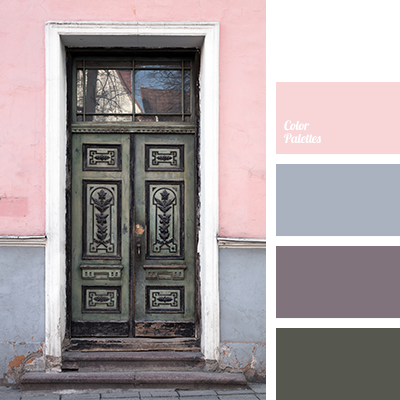
Where is `panel`? Image resolution: width=400 pixels, height=400 pixels. panel is located at coordinates (109, 161), (105, 204), (165, 220), (164, 296).